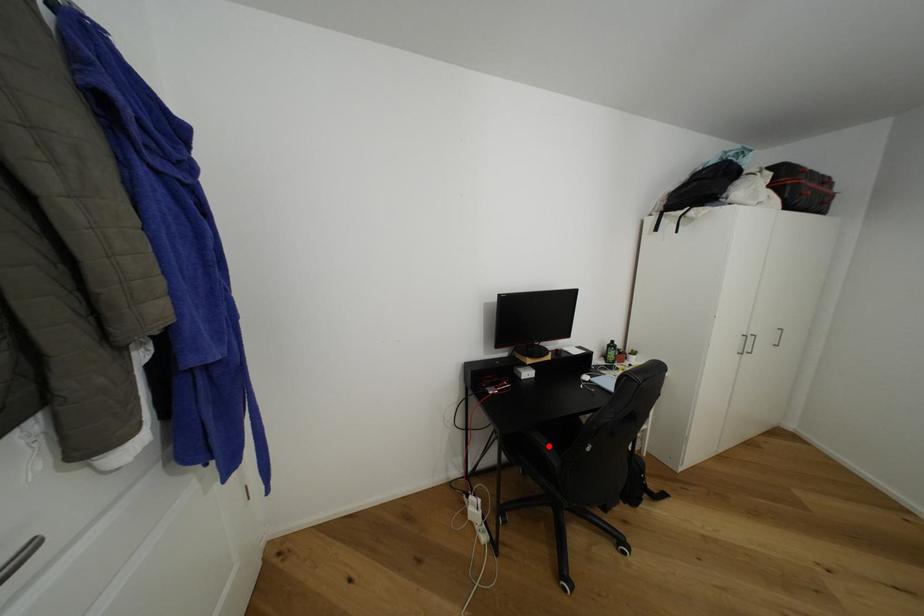
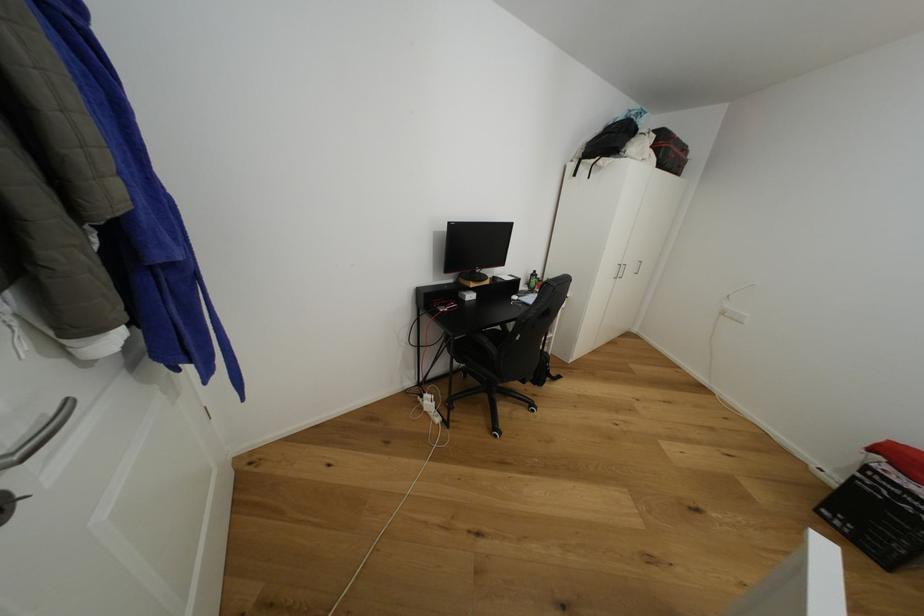
Find the pixel in the second image that matches the highlighted location in the first image.

(491, 342)